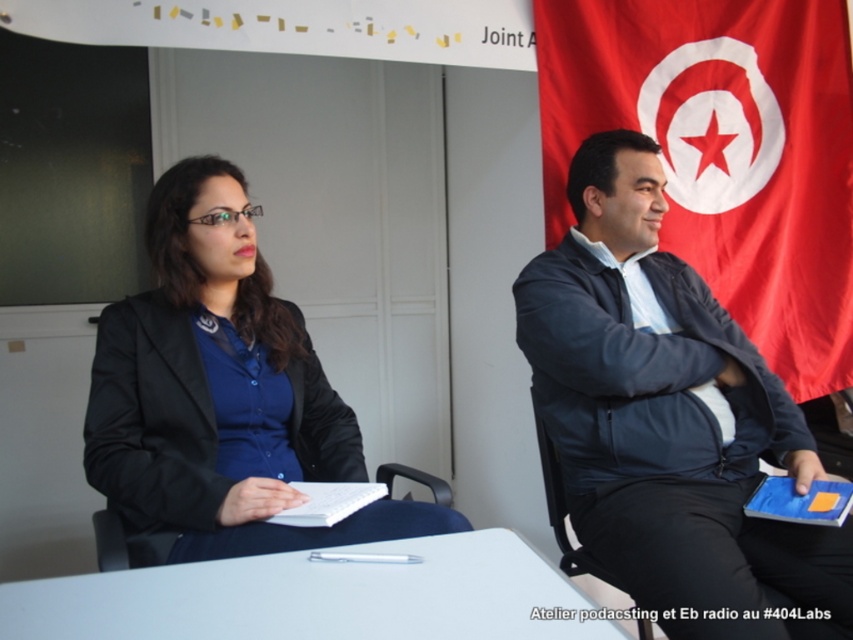
Can you confirm if red fabric flag at right is wider than white plastic table at center?

Yes, red fabric flag at right is wider than white plastic table at center.

Is red fabric flag at right to the right of white plastic table at center from the viewer's perspective?

Indeed, red fabric flag at right is positioned on the right side of white plastic table at center.

Who is more forward, (646, 33) or (502, 608)?

Point (502, 608)

Identify the location of red fabric flag at right. (724, 150).

Is dark blue jacket at right behind red fabric flag at right?

That is False.

Is dark blue jacket at right bigger than red fabric flag at right?

No, dark blue jacket at right is not bigger than red fabric flag at right.

The height and width of the screenshot is (640, 853). I want to click on dark blue jacket at right, so click(x=668, y=417).

Does point (756, 456) come in front of point (440, 621)?

No, it is not.

Which is behind, point (575, 516) or point (126, 621)?

Point (575, 516)

Measure the distance between point (601, 451) and camera.

Point (601, 451) is 1.51 meters away from camera.

What are the coordinates of `dark blue jacket at right` in the screenshot? It's located at (668, 417).